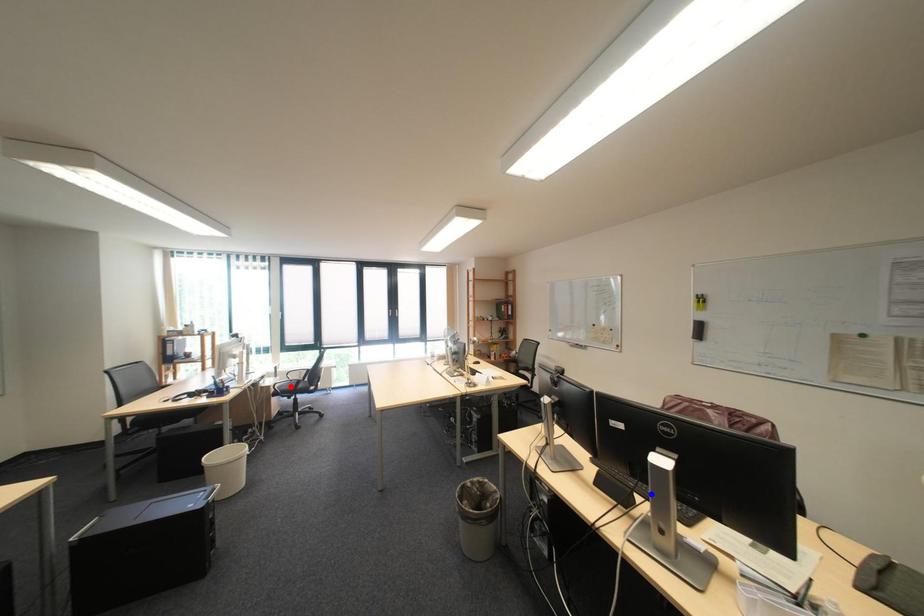
Question: Two points are marked on the image. Which point is closer to the camera?

Choices:
 (A) Blue point is closer.
 (B) Red point is closer.

Answer: (A)